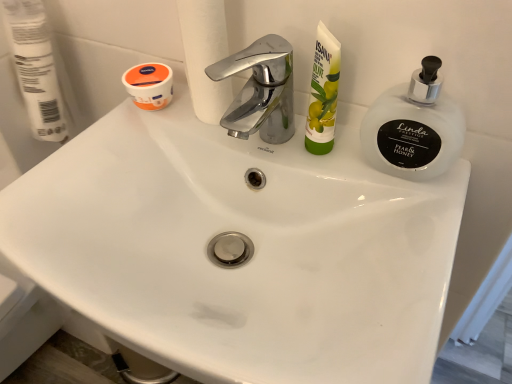
Question: Looking at the image, does frosted glass soap dispenser at upper right seem bigger or smaller compared to white matte toilet paper at upper center, which ranks as the 1th toilet paper in right-to-left order?

Choices:
 (A) big
 (B) small

Answer: (B)

Question: From a real-world perspective, is frosted glass soap dispenser at upper right positioned above or below white matte toilet paper at upper center, the second toilet paper positioned from the left?

Choices:
 (A) below
 (B) above

Answer: (A)

Question: Which object is positioned farthest from the green matte tube at upper right?

Choices:
 (A) frosted glass soap dispenser at upper right
 (B) white matte toilet paper at upper center, the second toilet paper positioned from the left
 (C) white matte toilet paper at upper left, placed as the 2th toilet paper when sorted from right to left
 (D) orange matte jar at upper left

Answer: (C)

Question: Which of these objects is positioned farthest from the green matte tube at upper right?

Choices:
 (A) white matte toilet paper at upper center, which ranks as the 1th toilet paper in right-to-left order
 (B) orange matte jar at upper left
 (C) frosted glass soap dispenser at upper right
 (D) white matte toilet paper at upper left, placed as the 2th toilet paper when sorted from right to left

Answer: (D)